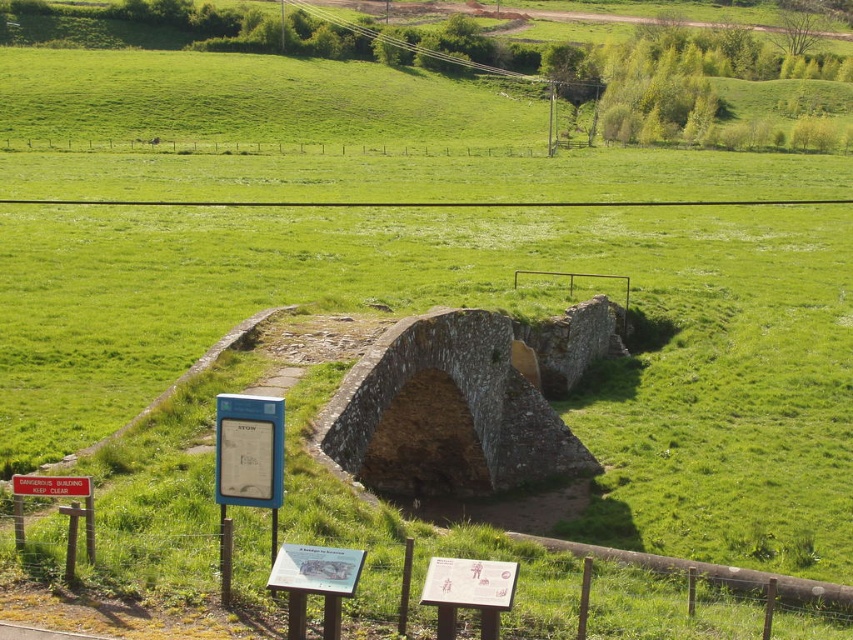
You are a tourist standing at the red plastic sign at lower left and want to cross the stone arch bridge at center. Which direction should you walk to reach the bridge?

You should walk to the right to reach the stone arch bridge at center since it is located to the right of the red plastic sign at lower left.

You are a tourist standing at the base of the stone arch bridge at center and want to read the red plastic sign at lower left. Can you see the entire sign without moving from your current position?

The red plastic sign at lower left is behind the stone arch bridge at center, so you cannot see the entire sign from your current position at the base of the bridge.

You are a tourist holding a camera that can only capture objects wider than 2 meters. You want to take a photo of the stone arch bridge at center and the red plastic sign at lower left. Which object will definitely fit in your camera frame?

The stone arch bridge at center is wider than the red plastic sign at lower left, so it will definitely fit in your camera frame since it is wider than 2 meters. The red plastic sign at lower left might be narrower and may not fit.